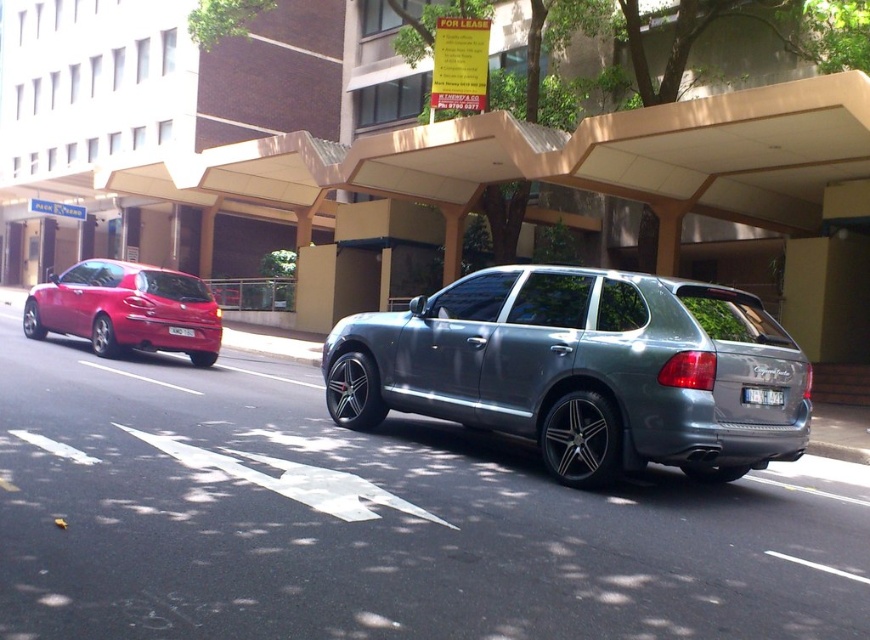
You are standing at the center of the road and see two points on the road ahead. The first point is labeled as point [699,369] and the second is point [761,404]. Which point is closer to you?

Point [699,369] is in front of point [761,404], so the first point is closer to you.

You are a parking attendant who needs to ensure vehicles are parked within height restrictions. The maximum allowed height for parking here is 1.8 meters. The white plastic license plate at center is 0.15 meters in height. Can the metallic gray suv at center be parked here without exceeding the height limit?

The metallic gray suv at center is much taller than the white plastic license plate at center, which is 0.15 meters. Since the SUV is significantly taller, it likely exceeds the 1.8 meters height limit and should not be parked here.